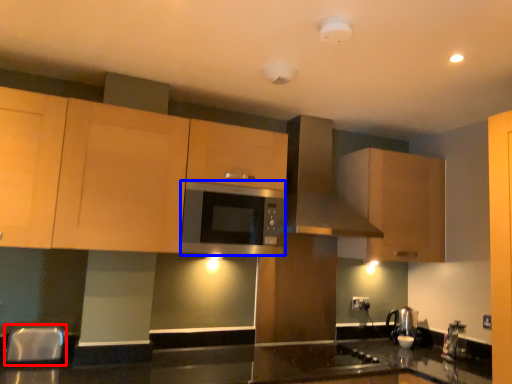
Question: Which of the following is the farthest to the observer, silver (highlighted by a red box) or microwave (highlighted by a blue box)?

Choices:
 (A) silver
 (B) microwave

Answer: (B)